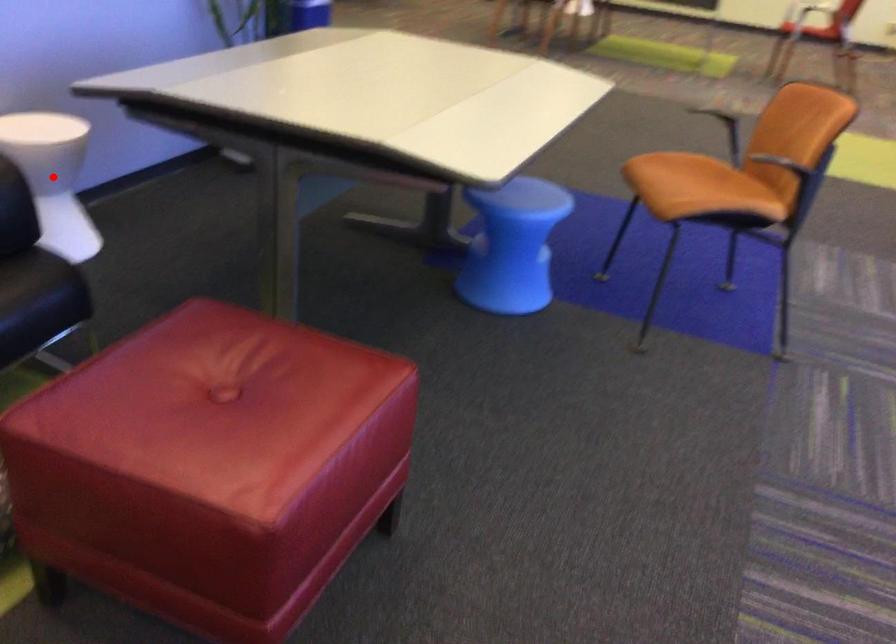
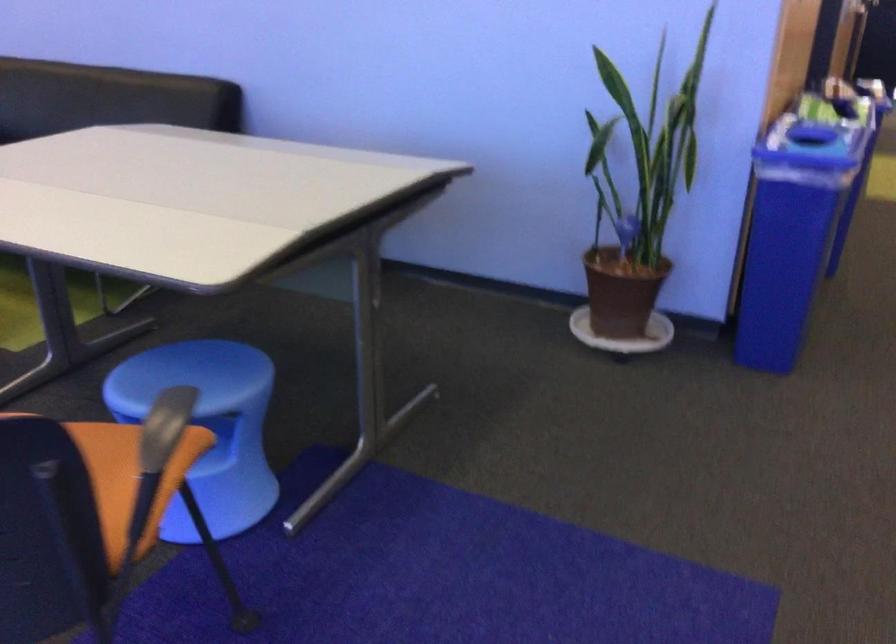
Question: I am providing you with two images of the same scene from different viewpoints. A red point is marked on the first image. At the location where the point appears in image 1, is it still visible in image 2?

Choices:
 (A) Yes
 (B) No

Answer: (B)